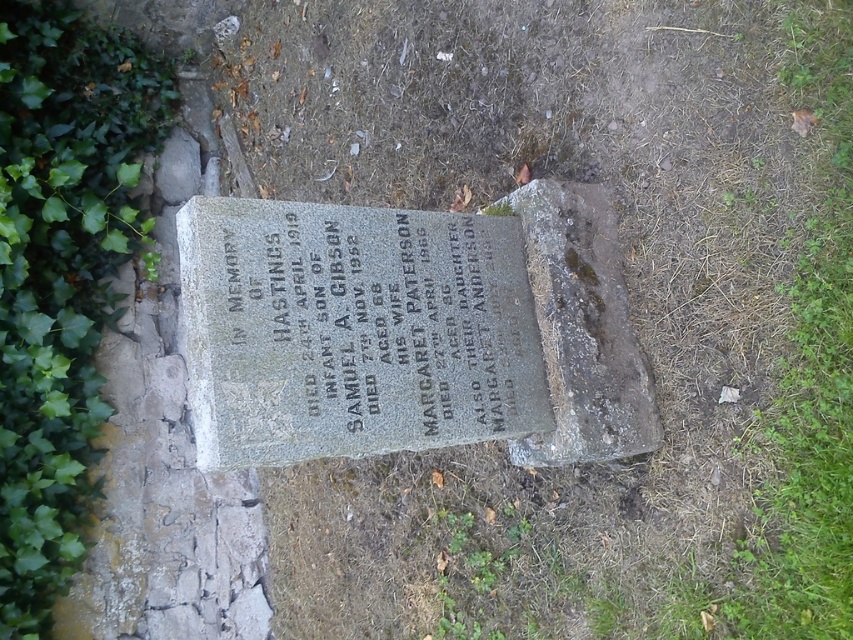
What is the relationship between the granite inscription at center and the green leafy ivy at lower left in terms of their vertical positioning?

The granite inscription at center is below the green leafy ivy at lower left.

What are the coordinates of the granite inscription at center?

The granite inscription at center is located at point (368, 326).

You are a gardener who needs to trim the green leafy ivy at lower left so it doesn not block the granite inscription at center. Based on the scene, which object is wider and requires more trimming?

The granite inscription at center is wider than the green leafy ivy at lower left, so the ivy needs to be trimmed to prevent it from covering the inscription.